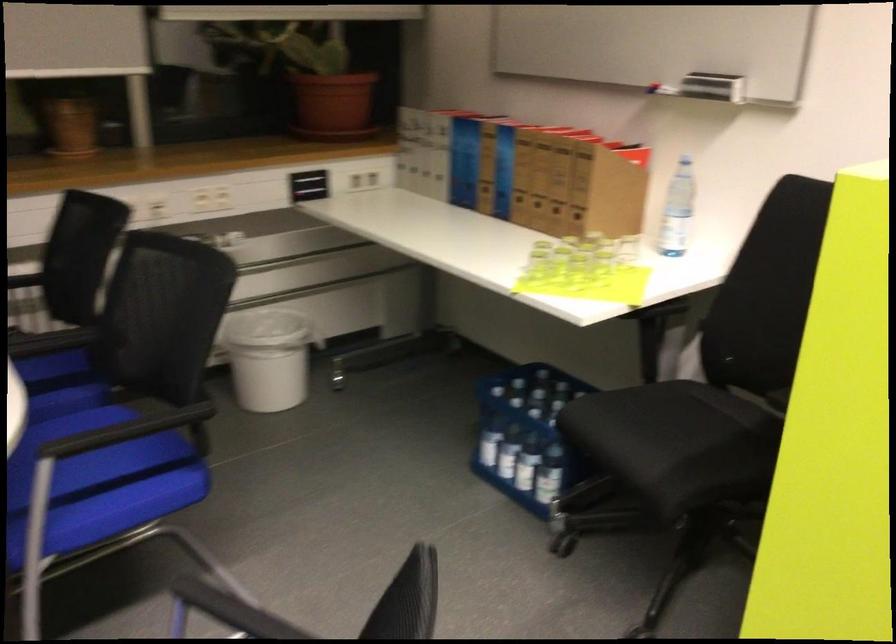
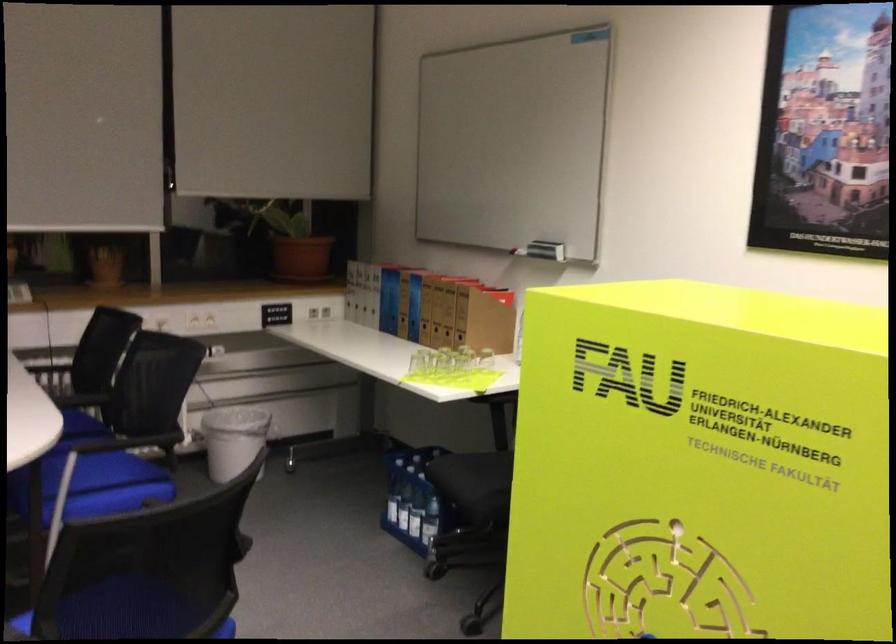
Where in the second image is the point corresponding to pixel 545 467 from the first image?

(429, 520)